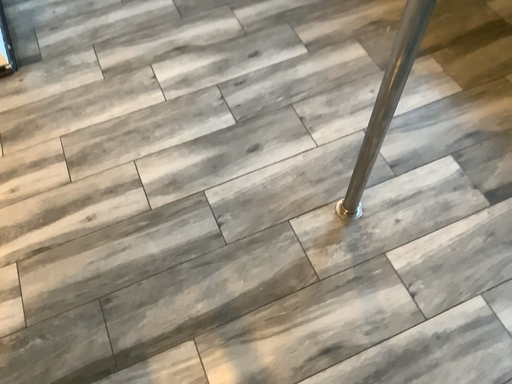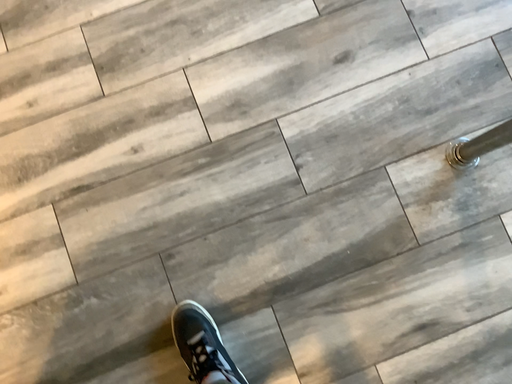
Question: Which way did the camera rotate in the video?

Choices:
 (A) rotated upward
 (B) rotated downward

Answer: (B)